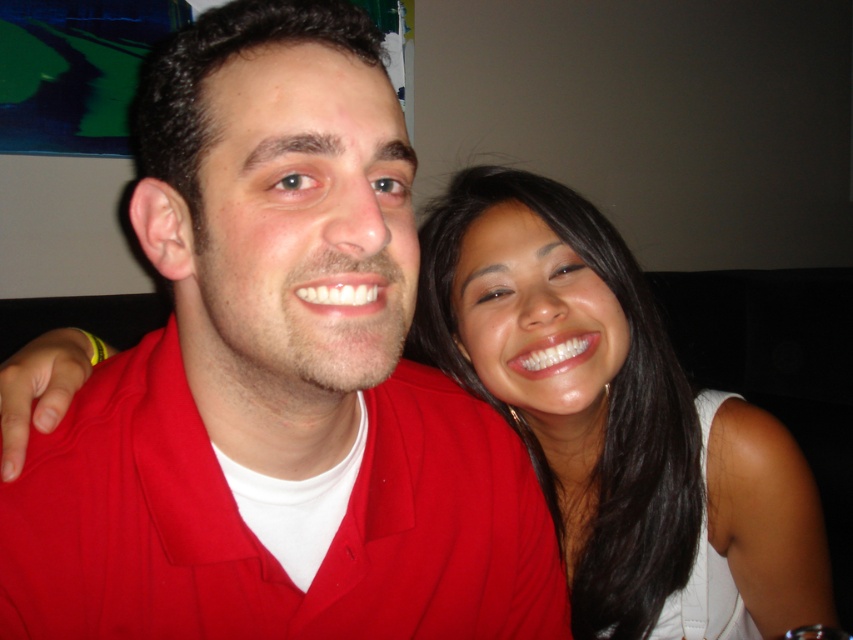
Who is lower down, matte red shirt at center or smooth white tank top at center?

smooth white tank top at center is below.

Does matte red shirt at center appear on the left side of smooth white tank top at center?

Yes, matte red shirt at center is to the left of smooth white tank top at center.

Does point (486, 548) come farther from viewer compared to point (677, 474)?

No, (486, 548) is closer to viewer.

Locate an element on the screen. matte red shirt at center is located at coordinates (276, 378).